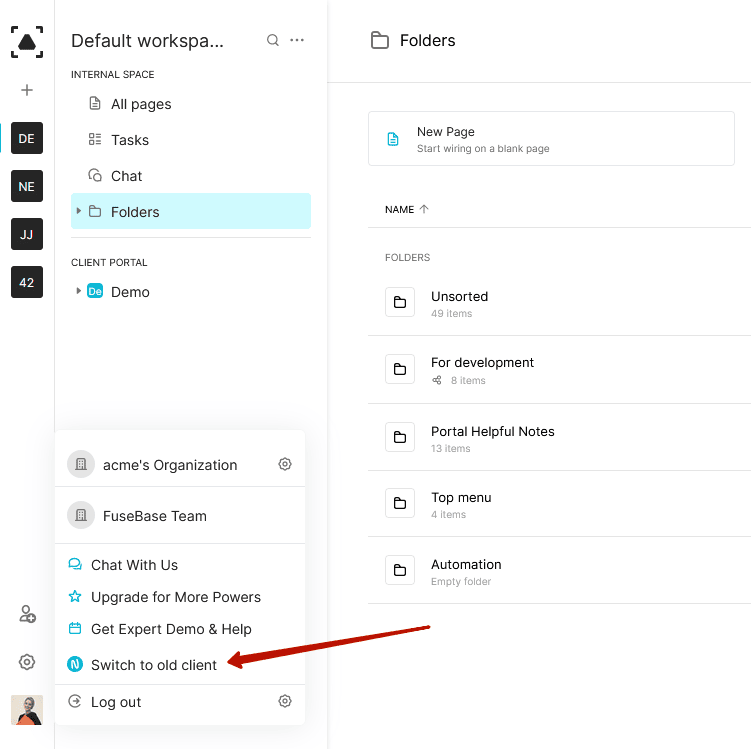
Locate an element on the screen. folders (highlighted blue) is located at coordinates (154, 207).